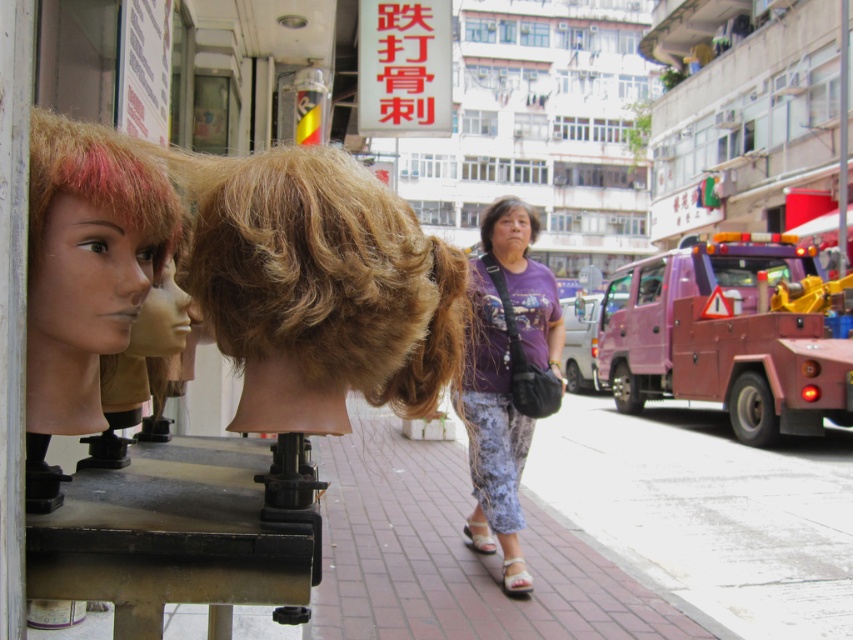
Does purple fabric shirt at center appear under purple matte head at center?

Indeed, purple fabric shirt at center is positioned under purple matte head at center.

Who is higher up, purple fabric shirt at center or purple matte head at center?

Positioned higher is purple matte head at center.

Describe the element at coordinates (503, 378) in the screenshot. I see `purple fabric shirt at center` at that location.

The image size is (853, 640). Find the location of `purple fabric shirt at center`. purple fabric shirt at center is located at coordinates (503, 378).

Does blonde synthetic wig at center have a greater width compared to purple matte head at center?

No, blonde synthetic wig at center is not wider than purple matte head at center.

Is point (274, 234) positioned behind point (523, 250)?

No, it is not.

Identify the location of blonde synthetic wig at center. This screenshot has width=853, height=640. (325, 276).

At what (x,y) coordinates should I click in order to perform the action: click on blonde synthetic wig at center. Please return your answer as a coordinate pair (x, y). Image resolution: width=853 pixels, height=640 pixels. Looking at the image, I should click on (325, 276).

Who is lower down, blonde synthetic wig at center or purple fabric shirt at center?

purple fabric shirt at center is below.

What do you see at coordinates (325, 276) in the screenshot?
I see `blonde synthetic wig at center` at bounding box center [325, 276].

Where is `blonde synthetic wig at center`? blonde synthetic wig at center is located at coordinates (325, 276).